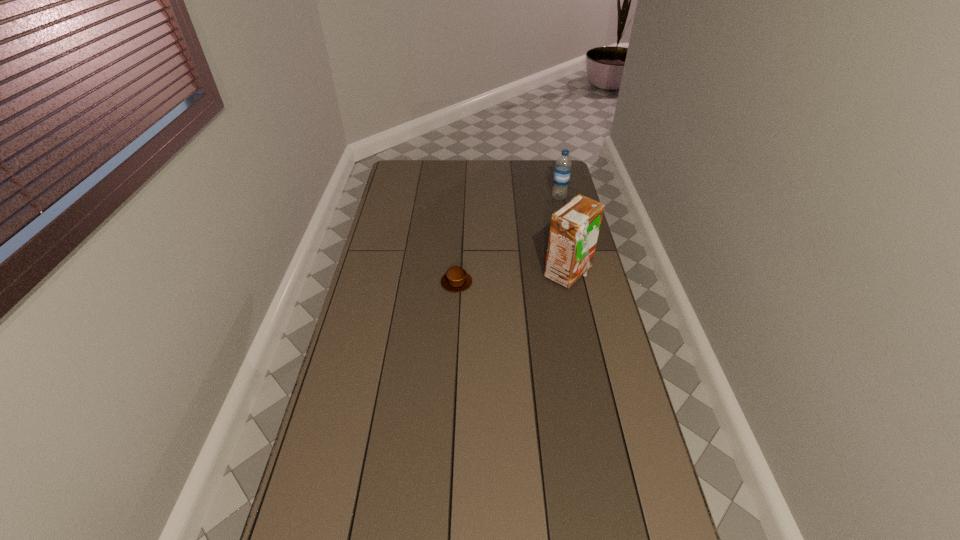
Identify the location of free space on the desktop that is between the shortest object and the tallest object and is positioned on the label of the water bottle. (500, 279).